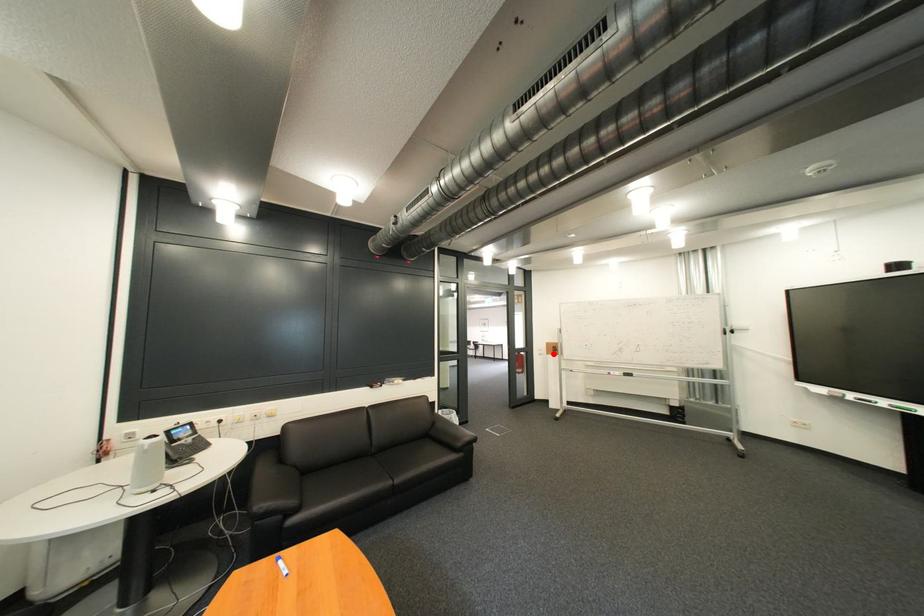
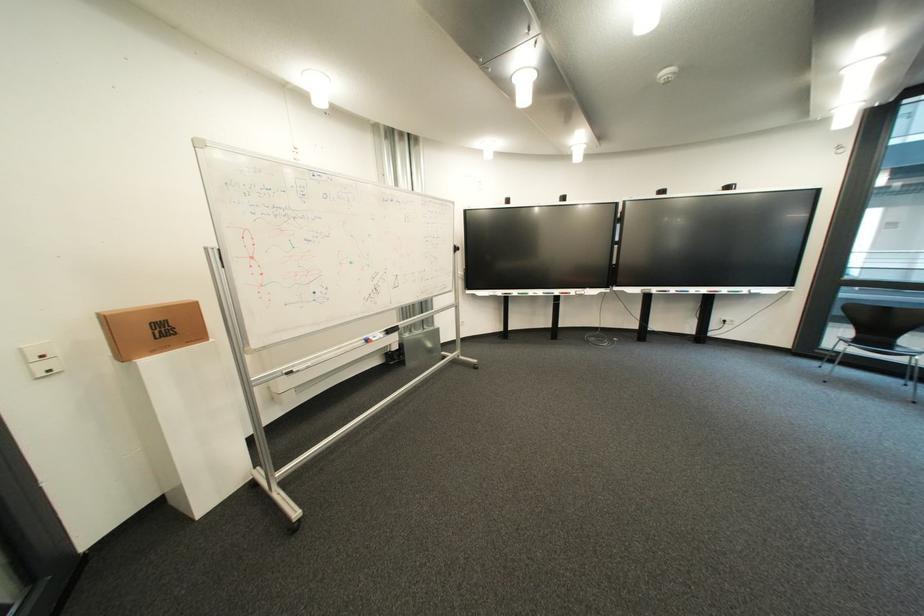
Locate, in the second image, the point that corresponds to the highlighted location in the first image.

(56, 368)